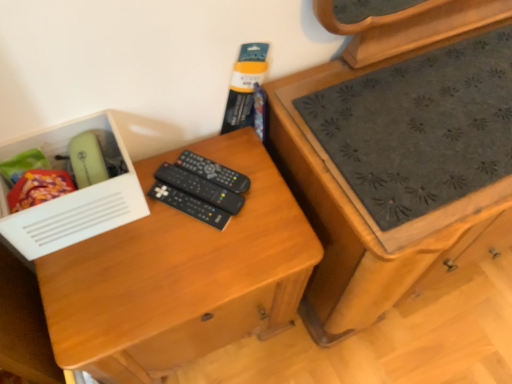
Question: From a real-world perspective, does white plastic box at left sit lower than black plastic remote controls at center, acting as the 3th remote control starting from the top?

Choices:
 (A) yes
 (B) no

Answer: (B)

Question: Is white plastic box at left further to camera compared to black plastic remote controls at center, which ranks as the 1th remote control in bottom-to-top order?

Choices:
 (A) yes
 (B) no

Answer: (B)

Question: Is white plastic box at left facing towards black plastic remote controls at center, which ranks as the 1th remote control in bottom-to-top order?

Choices:
 (A) yes
 (B) no

Answer: (B)

Question: Does white plastic box at left have a smaller size compared to black plastic remote controls at center, which ranks as the 1th remote control in bottom-to-top order?

Choices:
 (A) no
 (B) yes

Answer: (A)

Question: From the image's perspective, is white plastic box at left beneath black plastic remote controls at center, acting as the 3th remote control starting from the top?

Choices:
 (A) no
 (B) yes

Answer: (A)

Question: Based on their positions, is white plastic box at left located to the left or right of black plastic remote controls at center, which is counted as the 1th remote control, starting from the top?

Choices:
 (A) right
 (B) left

Answer: (B)

Question: Looking at the image, does white plastic box at left seem bigger or smaller compared to black plastic remote controls at center, which is counted as the 1th remote control, starting from the top?

Choices:
 (A) big
 (B) small

Answer: (A)

Question: Considering their positions, is white plastic box at left located in front of or behind black plastic remote controls at center, which is counted as the 1th remote control, starting from the top?

Choices:
 (A) behind
 (B) front

Answer: (B)

Question: Is point (67, 132) closer or farther from the camera than point (201, 168)?

Choices:
 (A) closer
 (B) farther

Answer: (A)

Question: Do you think black plastic remote controls at center, which ranks as the 1th remote control in bottom-to-top order, is within white plastic box at left, or outside of it?

Choices:
 (A) outside
 (B) inside

Answer: (A)

Question: From their relative heights in the image, would you say black plastic remote controls at center, which ranks as the 1th remote control in bottom-to-top order, is taller or shorter than white plastic box at left?

Choices:
 (A) short
 (B) tall

Answer: (A)

Question: Does point (170, 200) appear closer or farther from the camera than point (61, 125)?

Choices:
 (A) closer
 (B) farther

Answer: (B)

Question: Looking at their shapes, would you say black plastic remote controls at center, which ranks as the 1th remote control in bottom-to-top order, is wider or thinner than white plastic box at left?

Choices:
 (A) thin
 (B) wide

Answer: (B)

Question: Is black plastic remote controls at center, the second remote control positioned from the bottom, bigger or smaller than black plastic remote controls at center, which ranks as the 1th remote control in bottom-to-top order?

Choices:
 (A) small
 (B) big

Answer: (B)

Question: From the image's perspective, is black plastic remote controls at center, which is the 2th remote control from top to bottom, located above or below black plastic remote controls at center, which ranks as the 1th remote control in bottom-to-top order?

Choices:
 (A) below
 (B) above

Answer: (B)